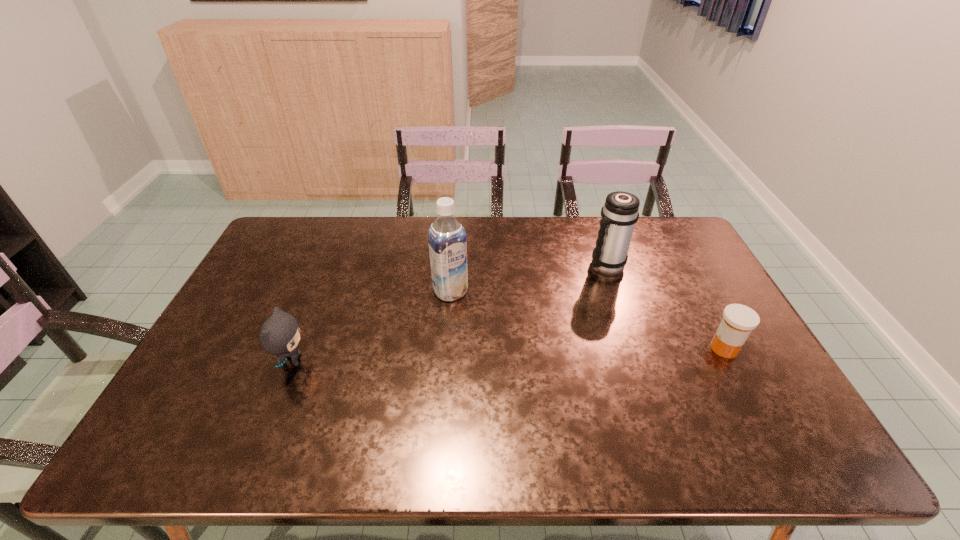
You are a GUI agent. You are given a task and a screenshot of the screen. Output one action in this format:
    pyautogui.click(x=<x>, y=<y>)
    Task: Click on the vacant space on the desktop that is between the leftmost object and the medicine and is positioned on the label of the third nearest object
    The width and height of the screenshot is (960, 540).
    Given the screenshot: What is the action you would take?
    pyautogui.click(x=496, y=355)

Locate an element on the screen. The image size is (960, 540). free space on the desktop that is between the third tallest object and the shortest object and is positioned on the side with the handle of the thermos bottle is located at coordinates (512, 355).